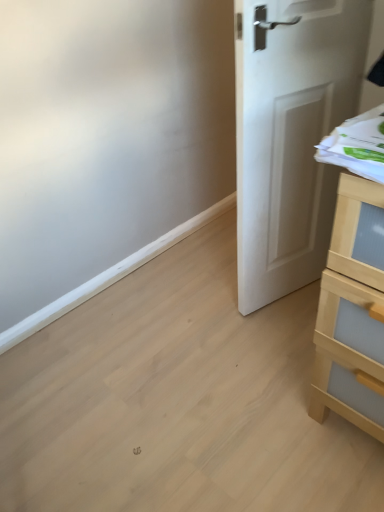
I want to click on free region on the left part of white matte door at center, so click(x=203, y=321).